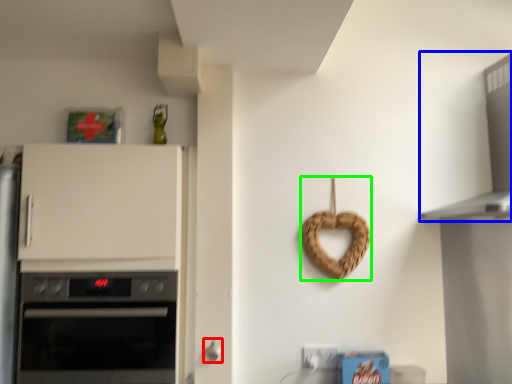
Question: Estimate the real-world distances between objects in this image. Which object is closer to door handle (highlighted by a red box), vent (highlighted by a blue box) or appliance (highlighted by a green box)?

Choices:
 (A) vent
 (B) appliance

Answer: (B)